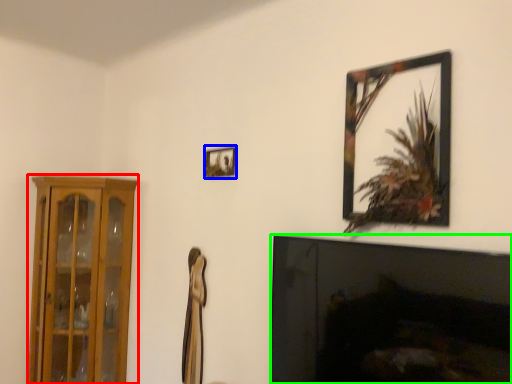
Question: Which is nearer to the cabinetry (highlighted by a red box)? picture frame (highlighted by a blue box) or fireplace (highlighted by a green box).

Choices:
 (A) picture frame
 (B) fireplace

Answer: (A)